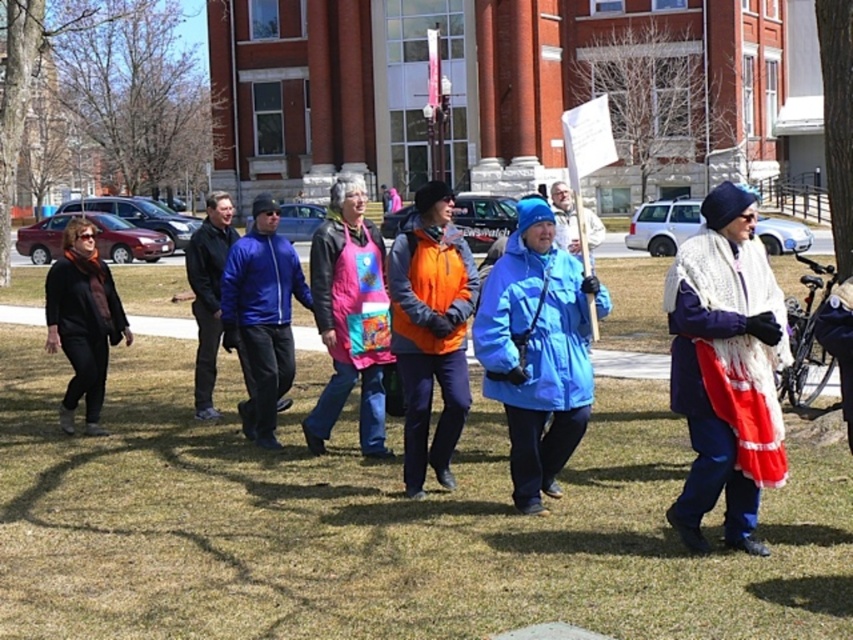
Question: Which of these objects is positioned farthest from the pink fabric apron at center?

Choices:
 (A) white knitted shawl at center
 (B) matte black jacket at left

Answer: (B)

Question: Among these objects, which one is nearest to the camera?

Choices:
 (A) white knitted shawl at center
 (B) blue matte jacket at center
 (C) orange fleece jacket at center
 (D) pink fabric apron at center

Answer: (A)

Question: Does blue matte jacket at center appear over pink fabric apron at center?

Choices:
 (A) yes
 (B) no

Answer: (B)

Question: Can you confirm if blue matte jacket at center is thinner than blue smooth jacket at center?

Choices:
 (A) no
 (B) yes

Answer: (B)

Question: Where is green grass at center located in relation to blue matte jacket at center in the image?

Choices:
 (A) left
 (B) right

Answer: (A)

Question: Which object appears closest to the camera in this image?

Choices:
 (A) green grass at center
 (B) orange fleece jacket at center

Answer: (A)